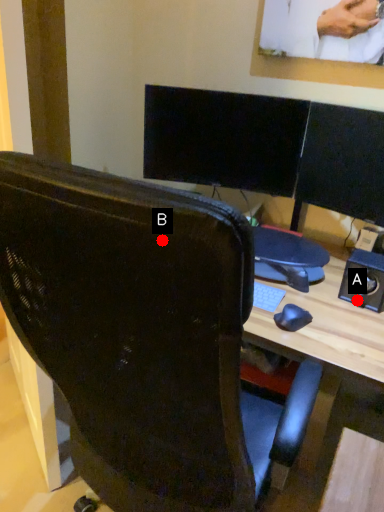
Question: Two points are circled on the image, labeled by A and B beside each circle. Which point is closer to the camera?

Choices:
 (A) A is closer
 (B) B is closer

Answer: (B)